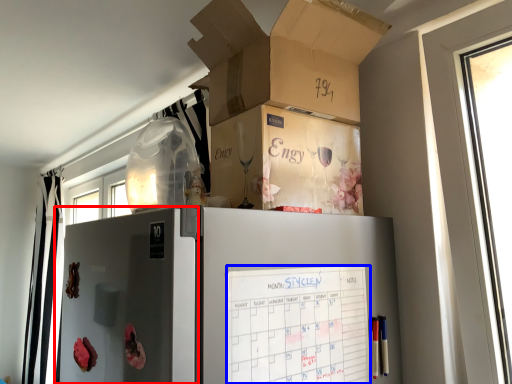
Question: Which object is further to the camera taking this photo, screen door (highlighted by a red box) or checklist (highlighted by a blue box)?

Choices:
 (A) screen door
 (B) checklist

Answer: (B)